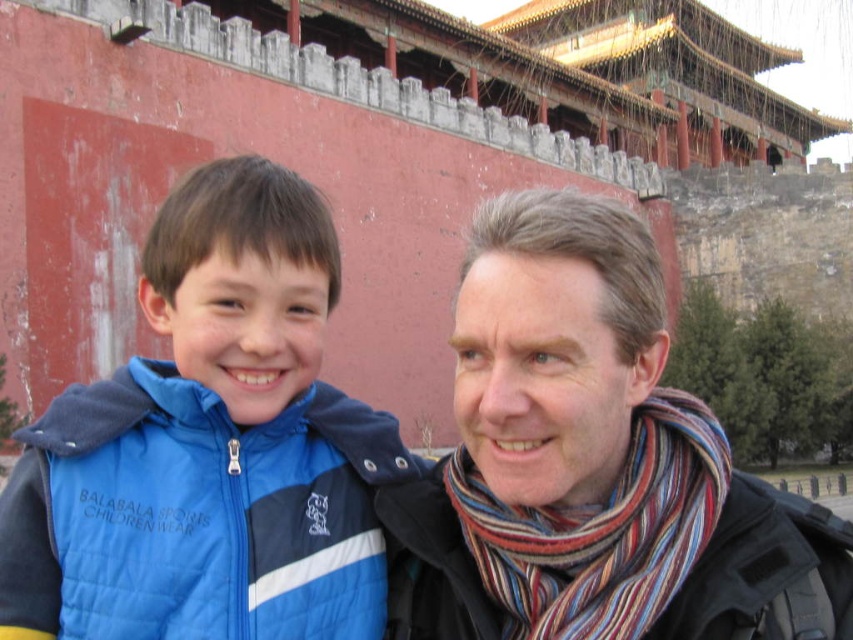
Question: Which object is closer to the camera taking this photo?

Choices:
 (A) striped wool scarf at right
 (B) striped scarf at center

Answer: (B)

Question: Among these points, which one is nearest to the camera?

Choices:
 (A) coord(433,544)
 (B) coord(132,444)

Answer: (B)

Question: From the image, what is the correct spatial relationship of blue quilted vest at left in relation to striped wool scarf at right?

Choices:
 (A) below
 (B) above

Answer: (B)

Question: Can you confirm if striped scarf at center is wider than striped wool scarf at right?

Choices:
 (A) yes
 (B) no

Answer: (A)

Question: Is striped scarf at center further to the viewer compared to striped wool scarf at right?

Choices:
 (A) yes
 (B) no

Answer: (B)

Question: Which point is farther to the camera?

Choices:
 (A) (779, 513)
 (B) (445, 525)

Answer: (B)